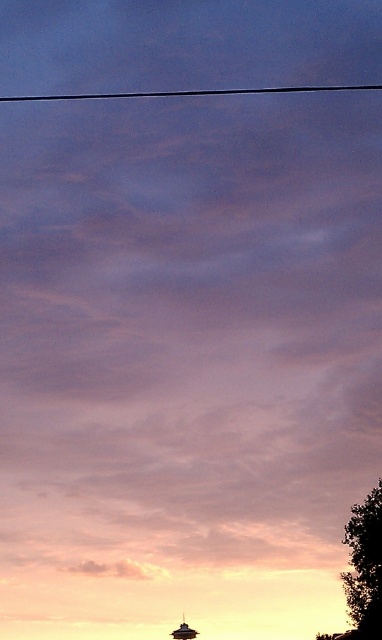
Which is more to the right, black wire at upper center or metallic silver boat at lower center?

From the viewer's perspective, metallic silver boat at lower center appears more on the right side.

Does black wire at upper center appear on the right side of metallic silver boat at lower center?

In fact, black wire at upper center is to the left of metallic silver boat at lower center.

This screenshot has height=640, width=382. Find the location of `black wire at upper center`. black wire at upper center is located at coordinates (x=191, y=92).

Is green leafy tree at right bigger than metallic silver boat at lower center?

Correct, green leafy tree at right is larger in size than metallic silver boat at lower center.

Is point (380, 584) in front of point (179, 636)?

No, it is not.

Locate an element on the screen. The height and width of the screenshot is (640, 382). green leafy tree at right is located at coordinates (364, 566).

Can you confirm if green leafy tree at right is wider than black wire at upper center?

Incorrect, green leafy tree at right's width does not surpass black wire at upper center's.

Between green leafy tree at right and black wire at upper center, which one appears on the left side from the viewer's perspective?

From the viewer's perspective, black wire at upper center appears more on the left side.

This screenshot has height=640, width=382. I want to click on green leafy tree at right, so click(x=364, y=566).